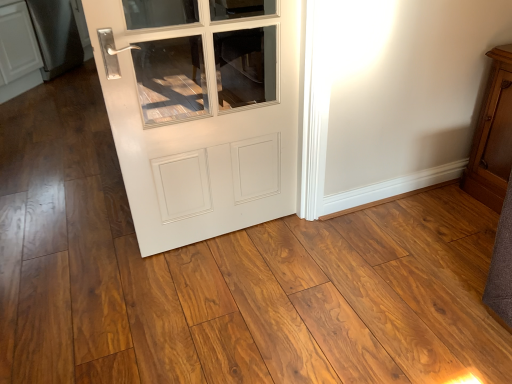
Question: Is satin black refrigerator at left at the right side of wooden cabinet at right?

Choices:
 (A) yes
 (B) no

Answer: (B)

Question: Is satin black refrigerator at left surrounding wooden cabinet at right?

Choices:
 (A) yes
 (B) no

Answer: (B)

Question: Is satin black refrigerator at left located outside wooden cabinet at right?

Choices:
 (A) no
 (B) yes

Answer: (B)

Question: Does satin black refrigerator at left have a lesser width compared to wooden cabinet at right?

Choices:
 (A) yes
 (B) no

Answer: (B)

Question: Is satin black refrigerator at left positioned before wooden cabinet at right?

Choices:
 (A) no
 (B) yes

Answer: (A)

Question: Does point (275, 99) appear closer or farther from the camera than point (70, 64)?

Choices:
 (A) closer
 (B) farther

Answer: (A)

Question: In the image, is white glossy door at center positioned in front of or behind satin black refrigerator at left?

Choices:
 (A) behind
 (B) front

Answer: (B)

Question: Visually, is white glossy door at center positioned to the left or to the right of satin black refrigerator at left?

Choices:
 (A) left
 (B) right

Answer: (B)

Question: Looking at the image, does white glossy door at center seem bigger or smaller compared to satin black refrigerator at left?

Choices:
 (A) big
 (B) small

Answer: (B)

Question: Based on their sizes in the image, would you say satin black refrigerator at left is bigger or smaller than wooden cabinet at right?

Choices:
 (A) small
 (B) big

Answer: (B)

Question: Is satin black refrigerator at left inside or outside of wooden cabinet at right?

Choices:
 (A) inside
 (B) outside

Answer: (B)

Question: In the image, is satin black refrigerator at left positioned in front of or behind wooden cabinet at right?

Choices:
 (A) behind
 (B) front

Answer: (A)

Question: In terms of width, does satin black refrigerator at left look wider or thinner when compared to wooden cabinet at right?

Choices:
 (A) thin
 (B) wide

Answer: (B)

Question: Does point (147, 160) appear closer or farther from the camera than point (474, 180)?

Choices:
 (A) farther
 (B) closer

Answer: (B)

Question: Is white glossy door at center bigger or smaller than wooden cabinet at right?

Choices:
 (A) big
 (B) small

Answer: (B)